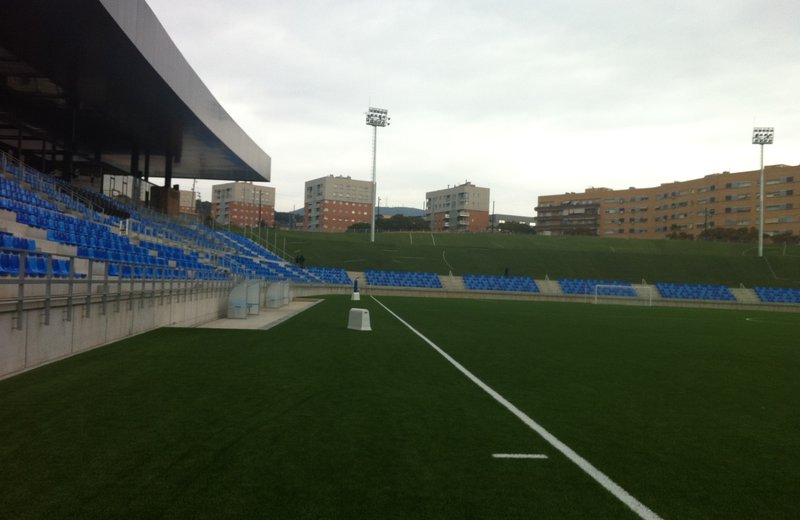
I want to click on seats, so click(124, 246).